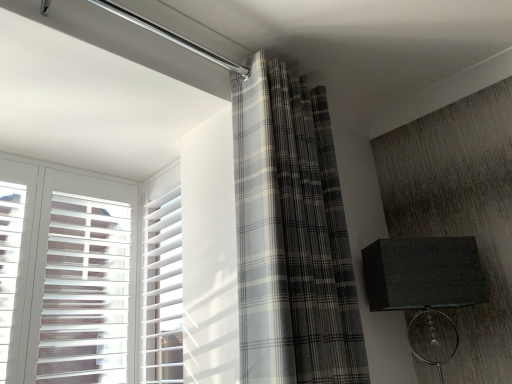
At what (x,y) coordinates should I click in order to perform the action: click on gray plaid curtain at center. Please return your answer as a coordinate pair (x, y). Looking at the image, I should click on (292, 236).

How far apart are white plastic blinds at left and gray plaid curtain at center?

A distance of 25.82 inches exists between white plastic blinds at left and gray plaid curtain at center.

How many degrees apart are the facing directions of white plastic blinds at left and gray plaid curtain at center?

87.5 degrees.

Which object is further away from the camera taking this photo, white plastic blinds at left or gray plaid curtain at center?

white plastic blinds at left.

Would you say white plastic blinds at left is outside gray plaid curtain at center?

Yes, white plastic blinds at left is located beyond the bounds of gray plaid curtain at center.

Is white plastic blinds at left with matte black lampshade at right?

white plastic blinds at left and matte black lampshade at right are not in contact.

Where is `window frame behind the matte black lampshade at right`? window frame behind the matte black lampshade at right is located at coordinates (162, 281).

Who is taller, white plastic blinds at left or matte black lampshade at right?

white plastic blinds at left.

From a real-world perspective, which object stands above the other?

white plastic blinds at left.

Considering the positions of points (422, 308) and (166, 287), is point (422, 308) closer to camera compared to point (166, 287)?

Yes, it is in front of point (166, 287).

From a real-world perspective, is matte black lampshade at right beneath white plastic blinds at left?

Yes, from a real-world perspective, matte black lampshade at right is below white plastic blinds at left.

Between matte black lampshade at right and white plastic blinds at left, which one has more height?

white plastic blinds at left is taller.

Consider the image. From the image's perspective, relative to gray plaid curtain at center, is matte black lampshade at right above or below?

matte black lampshade at right is below gray plaid curtain at center.

At what (x,y) coordinates should I click in order to perform the action: click on table lamp on the right of gray plaid curtain at center. Please return your answer as a coordinate pair (x, y). Looking at the image, I should click on (423, 273).

Is gray plaid curtain at center surrounded by matte black lampshade at right?

No.

Is gray plaid curtain at center oriented towards white plastic blinds at left?

No, gray plaid curtain at center does not turn towards white plastic blinds at left.

Who is more distant, gray plaid curtain at center or white plastic blinds at left?

white plastic blinds at left is behind.

Is point (280, 143) farther from camera compared to point (165, 189)?

No.

Would you consider gray plaid curtain at center to be distant from matte black lampshade at right?

No.

From a real-world perspective, is gray plaid curtain at center over matte black lampshade at right?

Yes.

From the image's perspective, who appears lower, gray plaid curtain at center or matte black lampshade at right?

matte black lampshade at right appears lower in the image.

Is gray plaid curtain at center positioned in front of matte black lampshade at right?

Yes, gray plaid curtain at center is closer to the camera.

The image size is (512, 384). Find the location of `window frame below the gray plaid curtain at center (from a real-world perspective)`. window frame below the gray plaid curtain at center (from a real-world perspective) is located at coordinates (162, 281).

Identify the location of table lamp in front of the white plastic blinds at left. The image size is (512, 384). (423, 273).

Looking at the image, which one is located further to white plastic blinds at left, gray plaid curtain at center or matte black lampshade at right?

matte black lampshade at right is further to white plastic blinds at left.

Looking at the image, which one is located further to matte black lampshade at right, white plastic blinds at left or gray plaid curtain at center?

Among the two, white plastic blinds at left is located further to matte black lampshade at right.

Looking at the image, which one is located closer to white plastic blinds at left, matte black lampshade at right or gray plaid curtain at center?

Based on the image, gray plaid curtain at center appears to be nearer to white plastic blinds at left.

Which object lies further to the anchor point gray plaid curtain at center, white plastic blinds at left or matte black lampshade at right?

white plastic blinds at left.

When comparing their distances from gray plaid curtain at center, does matte black lampshade at right or white plastic blinds at left seem closer?

matte black lampshade at right is closer to gray plaid curtain at center.

Based on their spatial positions, is gray plaid curtain at center or white plastic blinds at left closer to matte black lampshade at right?

gray plaid curtain at center is closer to matte black lampshade at right.

At what (x,y) coordinates should I click in order to perform the action: click on curtain located between white plastic blinds at left and matte black lampshade at right in the left-right direction. Please return your answer as a coordinate pair (x, y). Image resolution: width=512 pixels, height=384 pixels. Looking at the image, I should click on (292, 236).